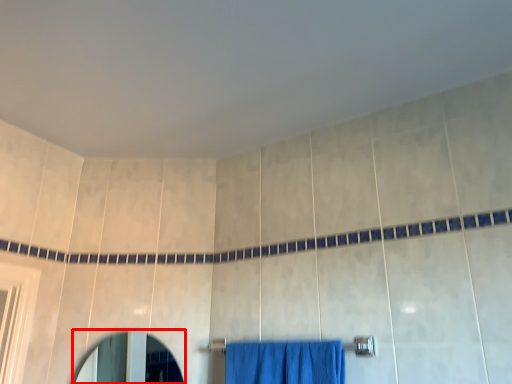
Question: From the image, what is the correct spatial relationship of mirror (annotated by the red box) in relation to towel bar?

Choices:
 (A) right
 (B) left

Answer: (B)